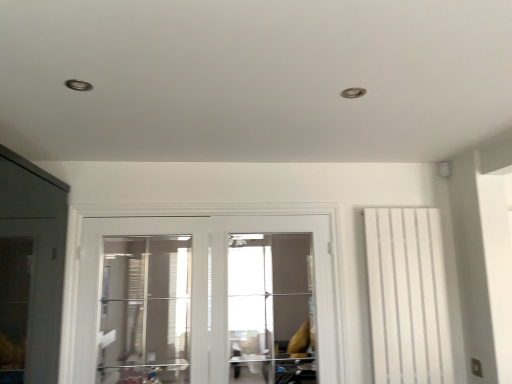
Question: Can you see white glossy door at center touching transparent glass screen door at center?

Choices:
 (A) no
 (B) yes

Answer: (A)

Question: From the image's perspective, is white glossy door at center located beneath transparent glass screen door at center?

Choices:
 (A) no
 (B) yes

Answer: (A)

Question: Does white glossy door at center come in front of transparent glass screen door at center?

Choices:
 (A) no
 (B) yes

Answer: (B)

Question: From the image's perspective, would you say white glossy door at center is positioned over transparent glass screen door at center?

Choices:
 (A) no
 (B) yes

Answer: (B)

Question: Does white glossy door at center appear on the right side of transparent glass screen door at center?

Choices:
 (A) no
 (B) yes

Answer: (A)

Question: Is point (376, 329) closer or farther from the camera than point (109, 306)?

Choices:
 (A) closer
 (B) farther

Answer: (A)

Question: From the image's perspective, is white matte radiator at right located above or below transparent glass door at center?

Choices:
 (A) above
 (B) below

Answer: (A)

Question: Is white matte radiator at right taller or shorter than transparent glass door at center?

Choices:
 (A) short
 (B) tall

Answer: (B)

Question: From a real-world perspective, is white matte radiator at right positioned above or below transparent glass door at center?

Choices:
 (A) below
 (B) above

Answer: (A)

Question: Is white glossy door at center in front of or behind transparent glass door at center in the image?

Choices:
 (A) front
 (B) behind

Answer: (A)

Question: From the image's perspective, is white glossy door at center located above or below transparent glass door at center?

Choices:
 (A) below
 (B) above

Answer: (B)

Question: Considering the relative positions of white glossy door at center and transparent glass door at center in the image provided, is white glossy door at center to the left or to the right of transparent glass door at center?

Choices:
 (A) right
 (B) left

Answer: (A)

Question: Is white glossy door at center inside or outside of transparent glass door at center?

Choices:
 (A) inside
 (B) outside

Answer: (A)

Question: In the image, is white matte radiator at right positioned in front of or behind white glossy door at center?

Choices:
 (A) front
 (B) behind

Answer: (B)

Question: Considering the positions of point (403, 382) and point (176, 216), is point (403, 382) closer or farther from the camera than point (176, 216)?

Choices:
 (A) closer
 (B) farther

Answer: (A)